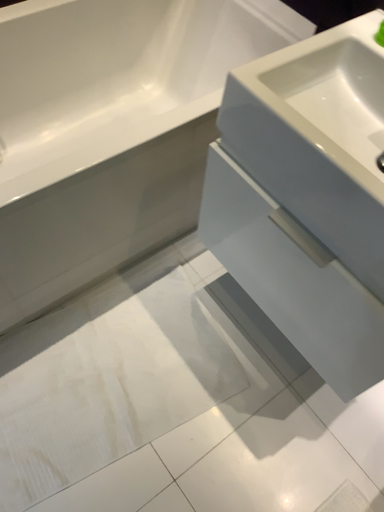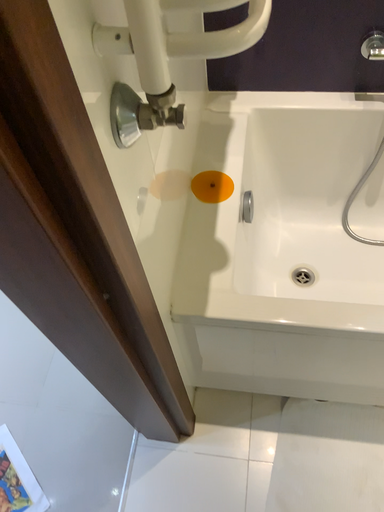
Question: How did the camera likely rotate when shooting the video?

Choices:
 (A) rotated downward
 (B) rotated upward

Answer: (B)